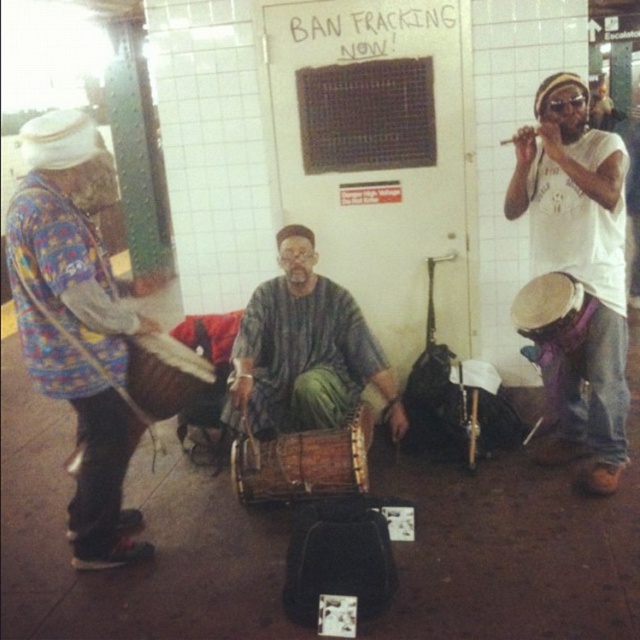
You are a photographer standing in the subway station where the musicians are performing. You want to take a photo of the textured brown drum at center from your current position. Considering the distance between you and the drum, can you comfortably fit the entire drum into your camera frame without zooming in?

The distance between the textured brown drum at center and the camera is 9.55 feet. Whether the entire drum can fit into the frame without zooming depends on the camera sensor size and lens focal length. However, at this distance, it might be challenging to capture the entire drum unless using a wide angle lens. For example, with a standard 50mm lens on a full frame camera, the field of view would be about 30 degrees, which may not encompass the drum if it is relatively large. A wider lens like 24mm would 1

You are a music enthusiast who wants to buy a drum that is wider. Which drum should you choose between the multicolored fabric drum at left and the textured brown drum at center?

The textured brown drum at center is wider than the multicolored fabric drum at left, so you should choose the textured brown drum at center.